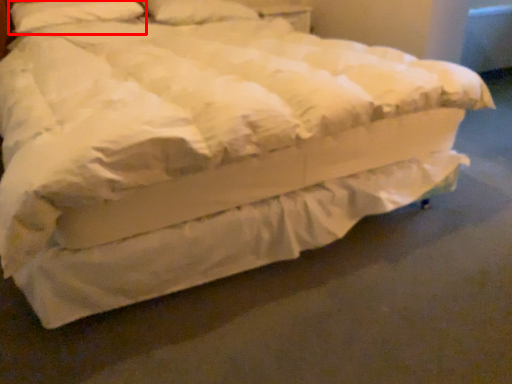
Question: From the image, what is the correct spatial relationship of pillow (annotated by the red box) in relation to pillow?

Choices:
 (A) right
 (B) left

Answer: (B)